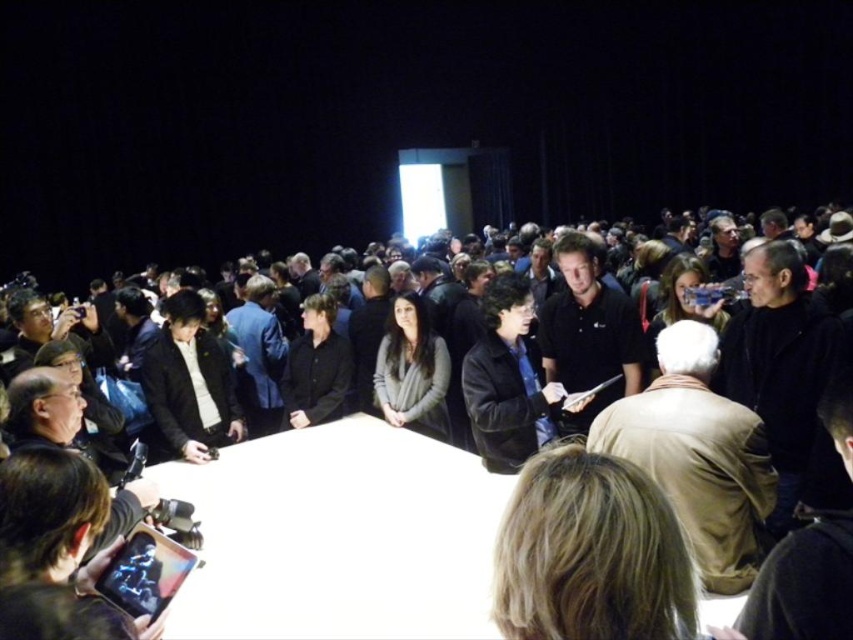
Question: Estimate the real-world distances between objects in this image. Which object is closer to the black matte shirt at center?

Choices:
 (A) black leather jacket at center
 (B) beige wool coat at center
 (C) blonde hair at lower center
 (D) dark brown leather jacket at center

Answer: (D)

Question: Which object appears farthest from the camera in this image?

Choices:
 (A) brown leather jacket at lower right
 (B) gray wool sweater at center

Answer: (B)

Question: Can you confirm if white glossy table at center is bigger than matte black phone at lower left?

Choices:
 (A) yes
 (B) no

Answer: (A)

Question: Is brown leather jacket at lower right in front of dark brown leather jacket at center?

Choices:
 (A) yes
 (B) no

Answer: (A)

Question: Which point is farther to the camera?

Choices:
 (A) (515, 480)
 (B) (582, 380)

Answer: (B)

Question: Can you confirm if white glossy table at center is positioned below blonde hair at lower center?

Choices:
 (A) no
 (B) yes

Answer: (B)